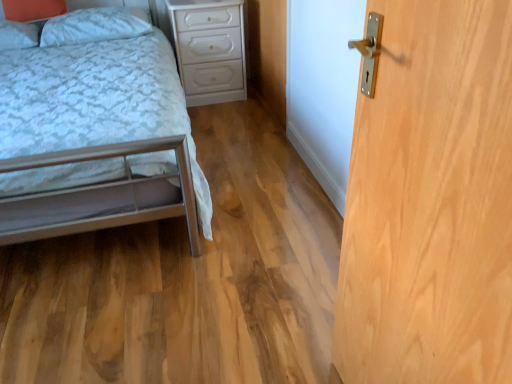
Where is `light wood/texture door at right`? This screenshot has height=384, width=512. light wood/texture door at right is located at coordinates (431, 202).

The width and height of the screenshot is (512, 384). I want to click on metallic silver bed at lower left, so click(96, 136).

Measure the distance between white glossy nightstand at center and camera.

white glossy nightstand at center is 2.81 meters from camera.

The height and width of the screenshot is (384, 512). What do you see at coordinates (95, 26) in the screenshot? I see `white soft pillow at upper left, which is the 1th pillow from right to left` at bounding box center [95, 26].

Where is `light wood/texture door at right`? light wood/texture door at right is located at coordinates (431, 202).

Considering the points (14, 34) and (186, 186), which point is behind, point (14, 34) or point (186, 186)?

The point (14, 34) is farther from the camera.

Is there a large distance between matte white pillow at upper left, placed as the 1th pillow when sorted from left to right, and metallic silver bed at lower left?

They are positioned close to each other.

Is matte white pillow at upper left, arranged as the second pillow when viewed from the right, turned away from metallic silver bed at lower left?

Yes, matte white pillow at upper left, arranged as the second pillow when viewed from the right,'s orientation is away from metallic silver bed at lower left.

In the scene shown: Is matte white pillow at upper left, arranged as the second pillow when viewed from the right, at the left side of metallic silver bed at lower left?

Correct, you'll find matte white pillow at upper left, arranged as the second pillow when viewed from the right, to the left of metallic silver bed at lower left.

Can you confirm if white glossy nightstand at center is taller than matte white pillow at upper left, placed as the 1th pillow when sorted from left to right?

Correct, white glossy nightstand at center is much taller as matte white pillow at upper left, placed as the 1th pillow when sorted from left to right.

Who is more distant, white glossy nightstand at center or matte white pillow at upper left, arranged as the second pillow when viewed from the right?

white glossy nightstand at center is further away from the camera.

Are white glossy nightstand at center and matte white pillow at upper left, placed as the 1th pillow when sorted from left to right, far apart?

white glossy nightstand at center is positioned a significant distance from matte white pillow at upper left, placed as the 1th pillow when sorted from left to right.

Looking at this image, is white glossy nightstand at center facing towards matte white pillow at upper left, arranged as the second pillow when viewed from the right?

No, white glossy nightstand at center is not oriented towards matte white pillow at upper left, arranged as the second pillow when viewed from the right.

Does point (81, 27) come closer to viewer compared to point (508, 205)?

No, (81, 27) is further to viewer.

Is white soft pillow at upper left, which is the 1th pillow from right to left, closer to camera compared to light wood/texture door at right?

No.

Is white soft pillow at upper left, which is the 1th pillow from right to left, looking in the opposite direction of light wood/texture door at right?

No, white soft pillow at upper left, which is the 1th pillow from right to left, is not facing the opposite direction of light wood/texture door at right.

Consider the image. From a real-world perspective, is white glossy nightstand at center positioned under light wood/texture door at right based on gravity?

Correct, in the physical world, white glossy nightstand at center is lower than light wood/texture door at right.

Is white glossy nightstand at center not within light wood/texture door at right?

Absolutely, white glossy nightstand at center is external to light wood/texture door at right.

From the image's perspective, which is below, white glossy nightstand at center or light wood/texture door at right?

light wood/texture door at right, from the image's perspective.

Relative to light wood/texture door at right, is white glossy nightstand at center in front or behind?

In the image, white glossy nightstand at center appears behind light wood/texture door at right.

In the image, is matte white pillow at upper left, placed as the 1th pillow when sorted from left to right, positioned in front of or behind white glossy nightstand at center?

matte white pillow at upper left, placed as the 1th pillow when sorted from left to right, is positioned closer to the viewer than white glossy nightstand at center.

Is the surface of matte white pillow at upper left, arranged as the second pillow when viewed from the right, in direct contact with white glossy nightstand at center?

matte white pillow at upper left, arranged as the second pillow when viewed from the right, is not next to white glossy nightstand at center, and they're not touching.

This screenshot has width=512, height=384. In the image, there is a matte white pillow at upper left, placed as the 1th pillow when sorted from left to right. What are the coordinates of `nightstand below it (from a real-world perspective)` in the screenshot? It's located at (210, 49).

Does matte white pillow at upper left, placed as the 1th pillow when sorted from left to right, appear on the left side of white glossy nightstand at center?

Correct, you'll find matte white pillow at upper left, placed as the 1th pillow when sorted from left to right, to the left of white glossy nightstand at center.

Is white soft pillow at upper left, which is the 1th pillow from right to left, positioned with its back to white glossy nightstand at center?

No, white soft pillow at upper left, which is the 1th pillow from right to left,'s orientation is not away from white glossy nightstand at center.

From the picture: Considering their positions, is white soft pillow at upper left, the 2th pillow positioned from the left, located in front of or behind white glossy nightstand at center?

Visually, white soft pillow at upper left, the 2th pillow positioned from the left, is located in front of white glossy nightstand at center.

Choose the correct answer: Is white soft pillow at upper left, the 2th pillow positioned from the left, inside white glossy nightstand at center or outside it?

white soft pillow at upper left, the 2th pillow positioned from the left, is located beyond the bounds of white glossy nightstand at center.

Is white soft pillow at upper left, which is the 1th pillow from right to left, to the left of white glossy nightstand at center from the viewer's perspective?

Correct, you'll find white soft pillow at upper left, which is the 1th pillow from right to left, to the left of white glossy nightstand at center.

From the image's perspective, between white glossy nightstand at center and metallic silver bed at lower left, who is located below?

metallic silver bed at lower left, from the image's perspective.

Is white glossy nightstand at center spatially inside metallic silver bed at lower left, or outside of it?

white glossy nightstand at center cannot be found inside metallic silver bed at lower left.

In the image, is white glossy nightstand at center on the left side or the right side of metallic silver bed at lower left?

Clearly, white glossy nightstand at center is on the right of metallic silver bed at lower left in the image.

Can you confirm if white glossy nightstand at center is thinner than metallic silver bed at lower left?

Yes, white glossy nightstand at center is thinner than metallic silver bed at lower left.

Find the location of a particular element. The width and height of the screenshot is (512, 384). bed that appears below the matte white pillow at upper left, arranged as the second pillow when viewed from the right (from a real-world perspective) is located at coordinates (96, 136).

This screenshot has width=512, height=384. Find the location of `nightstand on the right of the matte white pillow at upper left, arranged as the second pillow when viewed from the right`. nightstand on the right of the matte white pillow at upper left, arranged as the second pillow when viewed from the right is located at coordinates (210, 49).

Considering their positions, is metallic silver bed at lower left positioned closer to light wood/texture door at right than matte white pillow at upper left, placed as the 1th pillow when sorted from left to right?

The object closer to light wood/texture door at right is metallic silver bed at lower left.

Which object lies nearer to the anchor point metallic silver bed at lower left, white soft pillow at upper left, the 2th pillow positioned from the left, or light wood/texture door at right?

Among the two, white soft pillow at upper left, the 2th pillow positioned from the left, is located nearer to metallic silver bed at lower left.

Considering their positions, is light wood/texture door at right positioned closer to matte white pillow at upper left, placed as the 1th pillow when sorted from left to right, than white soft pillow at upper left, the 2th pillow positioned from the left?

white soft pillow at upper left, the 2th pillow positioned from the left, lies closer to matte white pillow at upper left, placed as the 1th pillow when sorted from left to right, than the other object.

From the image, which object appears to be farther from white soft pillow at upper left, which is the 1th pillow from right to left, metallic silver bed at lower left or light wood/texture door at right?

light wood/texture door at right is further to white soft pillow at upper left, which is the 1th pillow from right to left.

Looking at the image, which one is located closer to metallic silver bed at lower left, white soft pillow at upper left, which is the 1th pillow from right to left, or matte white pillow at upper left, arranged as the second pillow when viewed from the right?

white soft pillow at upper left, which is the 1th pillow from right to left, lies closer to metallic silver bed at lower left than the other object.

From the image, which object appears to be nearer to matte white pillow at upper left, arranged as the second pillow when viewed from the right, metallic silver bed at lower left or white soft pillow at upper left, which is the 1th pillow from right to left?

white soft pillow at upper left, which is the 1th pillow from right to left, is positioned closer to the anchor matte white pillow at upper left, arranged as the second pillow when viewed from the right.

From the image, which object appears to be nearer to light wood/texture door at right, metallic silver bed at lower left or white soft pillow at upper left, which is the 1th pillow from right to left?

Among the two, metallic silver bed at lower left is located nearer to light wood/texture door at right.

Based on their spatial positions, is white soft pillow at upper left, the 2th pillow positioned from the left, or metallic silver bed at lower left closer to light wood/texture door at right?

Among the two, metallic silver bed at lower left is located nearer to light wood/texture door at right.

Locate an element on the screen. pillow located between metallic silver bed at lower left and white soft pillow at upper left, the 2th pillow positioned from the left, in the depth direction is located at coordinates (18, 35).

The height and width of the screenshot is (384, 512). In order to click on pillow between matte white pillow at upper left, arranged as the second pillow when viewed from the right, and white glossy nightstand at center, in the horizontal direction in this screenshot , I will do `click(95, 26)`.

The image size is (512, 384). What are the coordinates of `bed positioned between light wood/texture door at right and matte white pillow at upper left, arranged as the second pillow when viewed from the right, from near to far` in the screenshot? It's located at 96,136.

You are a GUI agent. You are given a task and a screenshot of the screen. Output one action in this format:
    pyautogui.click(x=<x>, y=<y>)
    Task: Click on the bed between light wood/texture door at right and white glossy nightstand at center in the front-back direction
    
    Given the screenshot: What is the action you would take?
    pyautogui.click(x=96, y=136)